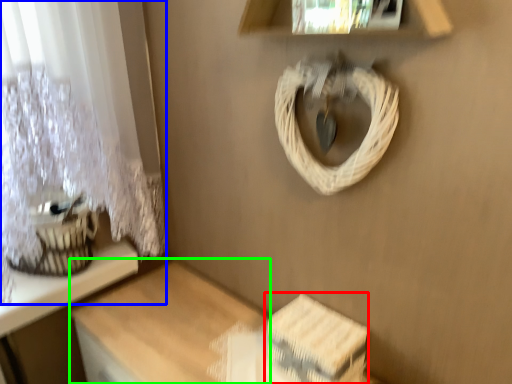
Question: Estimate the real-world distances between objects in this image. Which object is farther from storage box (highlighted by a red box), curtain (highlighted by a blue box) or table (highlighted by a green box)?

Choices:
 (A) curtain
 (B) table

Answer: (A)